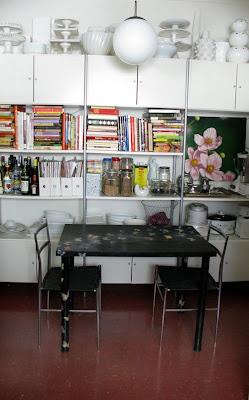
This screenshot has width=249, height=400. Identify the location of cabinet doors. pos(28,265), pos(114,269), pos(149,265), pos(231,268), pos(216,79), pos(162,76), pos(103,83), pos(54,74), pos(11,73), pos(242,100).